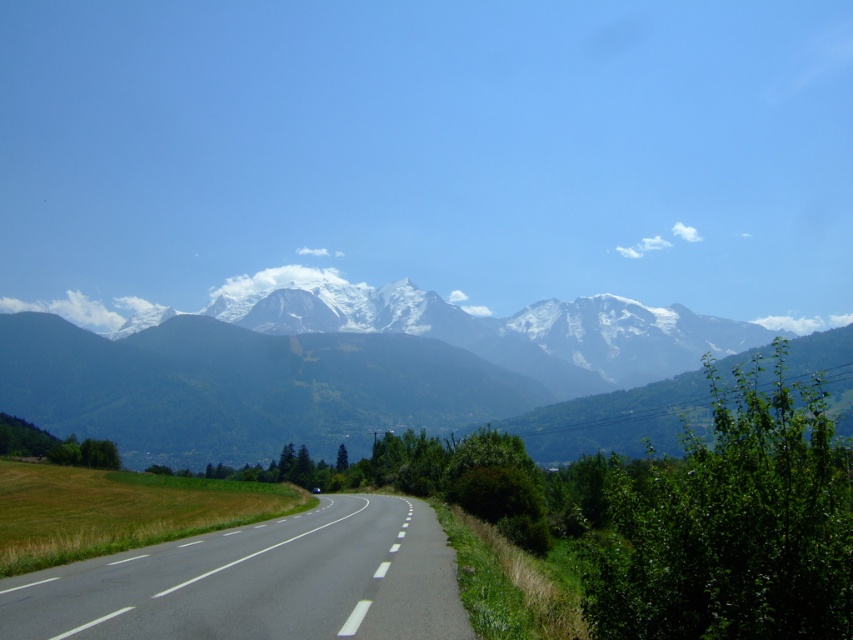
You are driving along the black asphalt road at center and want to adjust your mirrors to keep the snowy granite mountains at upper center in view. Which side of the road should you stay closer to?

You should stay closer to the left side of the black asphalt road at center because the snowy granite mountains at upper center are positioned to the right of the road, so staying left will keep them in view.

You are driving along the black asphalt road at center and want to reach the snowy granite mountains at upper center. Based on the scene, can you determine if the road leads directly towards the mountains?

The snowy granite mountains at upper center is located below black asphalt road at center, which means the road is positioned above the mountains. This suggests that the road does not lead directly towards the mountains but is instead situated higher up, possibly overlooking them.

You are standing at the starting point of the road in the image. You see two points marked on the road ahead of you. The first point is at coordinates point (x=824, y=340) and the second point is at point (x=218, y=580). Which of these two points is closer to your current position?

Point (x=218, y=580) is closer to your current position because it is nearer to the camera compared to point (x=824, y=340), which is further away.